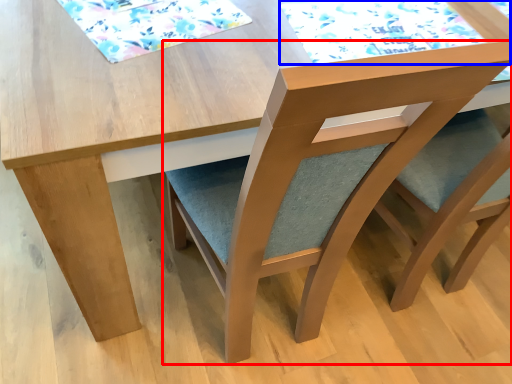
Question: Which object is further to the camera taking this photo, chair (highlighted by a red box) or mat (highlighted by a blue box)?

Choices:
 (A) chair
 (B) mat

Answer: (B)